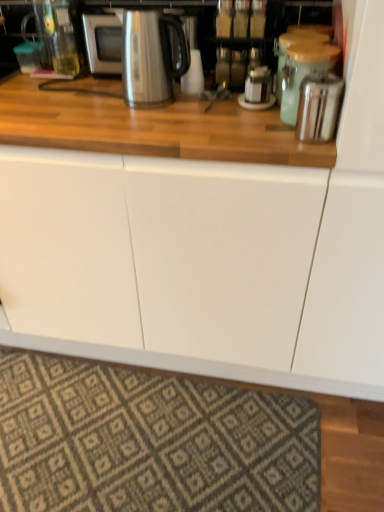
Question: Is point (314, 72) positioned closer to the camera than point (294, 460)?

Choices:
 (A) closer
 (B) farther

Answer: (A)

Question: Would you say green matte jar at upper right, which appears as the 2th appliance when viewed from the front, is to the left or to the right of patterned carpet at lower center in the picture?

Choices:
 (A) right
 (B) left

Answer: (A)

Question: Which object is positioned closest to the green matte jar at upper right, which appears as the 2th appliance when viewed from the front?

Choices:
 (A) patterned carpet at lower center
 (B) metallic silver canister at upper right, the third appliance in the front-to-back sequence
 (C) satin silver microwave at upper center
 (D) stainless steel kettle at upper center
 (E) satin silver toaster at upper right, the first appliance from the front

Answer: (B)

Question: Estimate the real-world distances between objects in this image. Which object is farther from the satin silver toaster at upper right, the first appliance from the front?

Choices:
 (A) stainless steel kettle at upper center
 (B) green matte jar at upper right, which appears as the 2th appliance when viewed from the front
 (C) metallic silver canister at upper right, the third appliance in the front-to-back sequence
 (D) patterned carpet at lower center
 (E) satin silver microwave at upper center

Answer: (D)